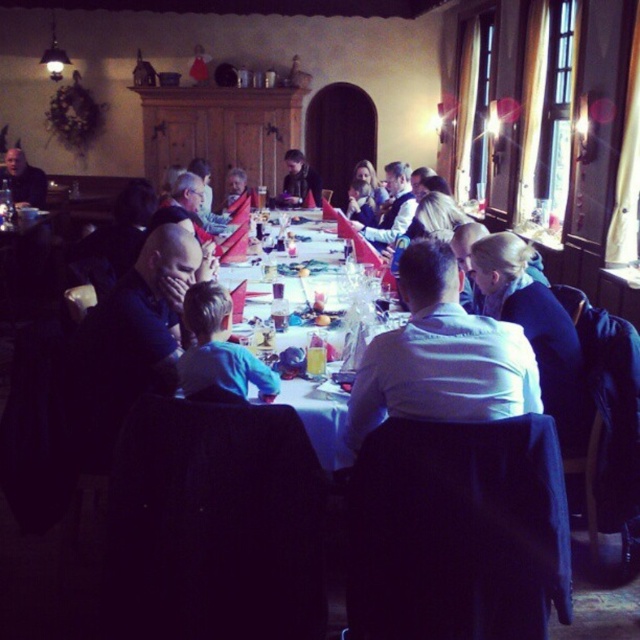
Does point (227, 308) come in front of point (356, 348)?

Yes, point (227, 308) is closer to viewer.

Is blue cotton shirt at center thinner than white glossy table at center?

Yes, blue cotton shirt at center is thinner than white glossy table at center.

Between point (259, 371) and point (276, 323), which one is positioned behind?

The point (276, 323) is more distant.

Locate an element on the screen. The width and height of the screenshot is (640, 640). blue cotton shirt at center is located at coordinates (218, 348).

Who is positioned more to the right, white shirt at center or blue cotton shirt at center?

Positioned to the right is white shirt at center.

Where is `white shirt at center`? white shirt at center is located at coordinates (440, 356).

Can you confirm if matte black jacket at left is smaller than dark brown leather jacket at center?

No, matte black jacket at left is not smaller than dark brown leather jacket at center.

Can you confirm if matte black jacket at left is shorter than dark brown leather jacket at center?

No.

Identify the location of matte black jacket at left. This screenshot has height=640, width=640. (22, 179).